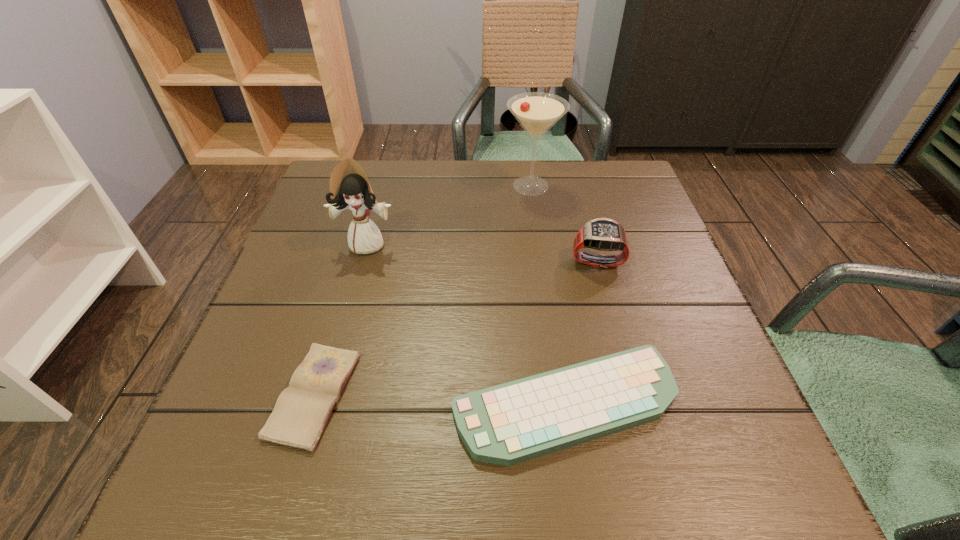
Locate an element on the screen. Image resolution: width=960 pixels, height=540 pixels. vacant area that lies between the diary and the martini is located at coordinates (422, 291).

Locate an element on the screen. free space that is in between the third tallest object and the diary is located at coordinates (456, 328).

Where is `free space between the martini and the diary`? The image size is (960, 540). free space between the martini and the diary is located at coordinates (422, 291).

The image size is (960, 540). I want to click on vacant area that lies between the third shortest object and the shortest object, so click(456, 328).

Identify which object is located as the third nearest to the third shortest object. Please provide its 2D coordinates. Your answer should be formatted as a tuple, i.e. [(x, y)], where the tuple contains the x and y coordinates of a point satisfying the conditions above.

[(349, 187)]

At what (x,y) coordinates should I click in order to perform the action: click on object that stands as the second closest to the diary. Please return your answer as a coordinate pair (x, y). This screenshot has height=540, width=960. Looking at the image, I should click on (349, 187).

The height and width of the screenshot is (540, 960). Identify the location of free location that satisfies the following two spatial constraints: 1. at the front face of the watch; 2. on the right side of the doll. (363, 261).

You are a GUI agent. You are given a task and a screenshot of the screen. Output one action in this format:
    pyautogui.click(x=<x>, y=<y>)
    Task: Click on the free point that satisfies the following two spatial constraints: 1. at the front face of the second shortest object; 2. on the right side of the doll
    The height and width of the screenshot is (540, 960).
    Given the screenshot: What is the action you would take?
    pyautogui.click(x=324, y=403)